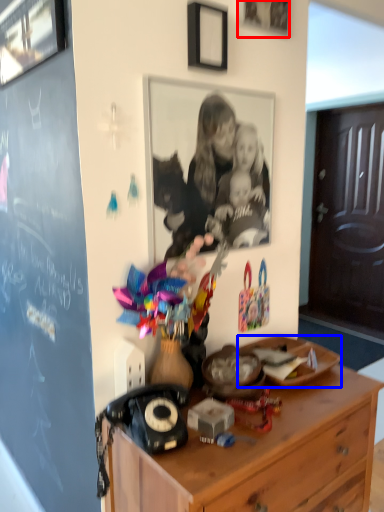
Question: Which object is closer to the camera taking this photo, picture frame (highlighted by a red box) or plate (highlighted by a blue box)?

Choices:
 (A) picture frame
 (B) plate

Answer: (A)